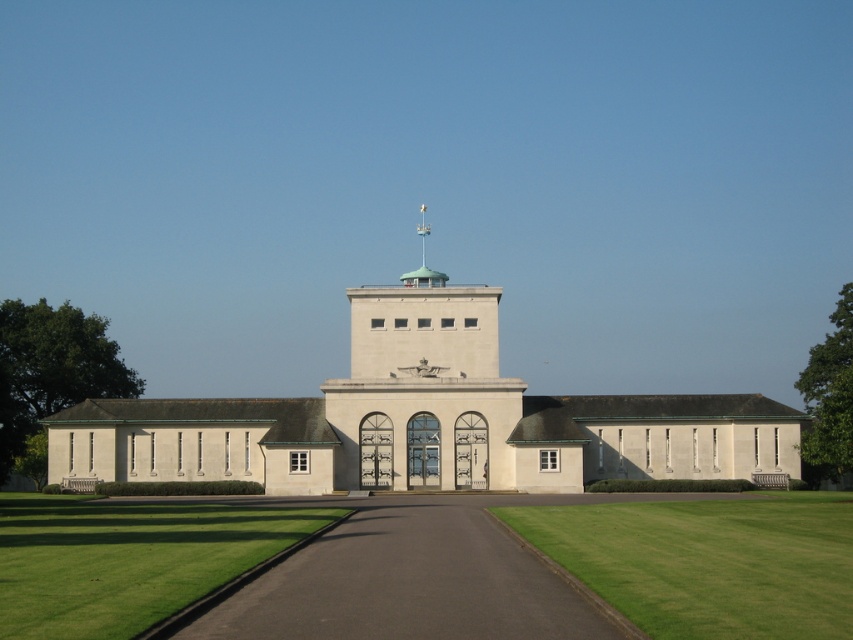
Measure the distance between black asphalt driveway at center and green grass at lower left.

The distance of black asphalt driveway at center from green grass at lower left is 19.80 feet.

Can you confirm if black asphalt driveway at center is taller than green grass at lower left?

In fact, black asphalt driveway at center may be shorter than green grass at lower left.

Is point (300, 636) positioned behind point (35, 616)?

No, it is in front of (35, 616).

Identify the location of black asphalt driveway at center. The width and height of the screenshot is (853, 640). 413,579.

Is black asphalt driveway at center positioned in front of green grass at center?

No, it is not.

Is black asphalt driveway at center above green grass at center?

Yes.

Is point (223, 612) in front of point (595, 579)?

Yes, point (223, 612) is in front of point (595, 579).

The height and width of the screenshot is (640, 853). In order to click on black asphalt driveway at center in this screenshot , I will do `click(413, 579)`.

Is green grass at center above white stone bell tower at center?

No, green grass at center is not above white stone bell tower at center.

Is green grass at center to the right of white stone bell tower at center from the viewer's perspective?

Indeed, green grass at center is positioned on the right side of white stone bell tower at center.

Which is behind, point (828, 620) or point (408, 280)?

Positioned behind is point (408, 280).

You are a GUI agent. You are given a task and a screenshot of the screen. Output one action in this format:
    pyautogui.click(x=<x>, y=<y>)
    Task: Click on the green grass at center
    The width and height of the screenshot is (853, 640).
    Given the screenshot: What is the action you would take?
    pyautogui.click(x=708, y=563)